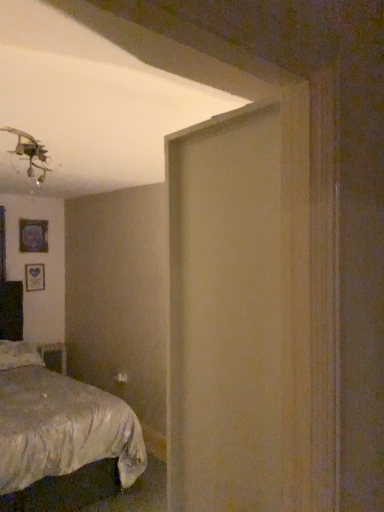
Question: Is silky white bed at lower left oriented towards matte black picture frame at upper left, which is counted as the second picture frame, starting from the bottom?

Choices:
 (A) yes
 (B) no

Answer: (B)

Question: Does silky white bed at lower left lie in front of matte black picture frame at upper left, the first picture frame from the top?

Choices:
 (A) yes
 (B) no

Answer: (A)

Question: From a real-world perspective, is silky white bed at lower left under matte black picture frame at upper left, the first picture frame from the top?

Choices:
 (A) yes
 (B) no

Answer: (A)

Question: From the image's perspective, is silky white bed at lower left located beneath matte black picture frame at upper left, the first picture frame from the top?

Choices:
 (A) no
 (B) yes

Answer: (B)

Question: Considering the relative sizes of silky white bed at lower left and matte black picture frame at upper left, the first picture frame from the top, in the image provided, is silky white bed at lower left wider than matte black picture frame at upper left, the first picture frame from the top,?

Choices:
 (A) no
 (B) yes

Answer: (B)

Question: From a real-world perspective, is wooden table at lower left above or below matte black picture frame at upper left, the first picture frame from the top?

Choices:
 (A) above
 (B) below

Answer: (B)

Question: Is wooden table at lower left inside or outside of matte black picture frame at upper left, the first picture frame from the top?

Choices:
 (A) inside
 (B) outside

Answer: (B)

Question: Based on their sizes in the image, would you say wooden table at lower left is bigger or smaller than matte black picture frame at upper left, which is counted as the second picture frame, starting from the bottom?

Choices:
 (A) big
 (B) small

Answer: (A)

Question: Relative to matte black picture frame at upper left, which is counted as the second picture frame, starting from the bottom, is wooden table at lower left in front or behind?

Choices:
 (A) behind
 (B) front

Answer: (A)

Question: Considering the positions of point (33, 221) and point (62, 376), is point (33, 221) closer or farther from the camera than point (62, 376)?

Choices:
 (A) closer
 (B) farther

Answer: (B)

Question: From a real-world perspective, relative to silky white bed at lower left, is matte black picture frame at upper left, the first picture frame from the top, vertically above or below?

Choices:
 (A) below
 (B) above

Answer: (B)

Question: In terms of height, does matte black picture frame at upper left, the first picture frame from the top, look taller or shorter compared to silky white bed at lower left?

Choices:
 (A) tall
 (B) short

Answer: (B)

Question: Considering the positions of matte black picture frame at upper left, the first picture frame from the top, and silky white bed at lower left in the image, is matte black picture frame at upper left, the first picture frame from the top, bigger or smaller than silky white bed at lower left?

Choices:
 (A) small
 (B) big

Answer: (A)

Question: Considering their positions, is wooden table at lower left located in front of or behind silky white bed at lower left?

Choices:
 (A) behind
 (B) front

Answer: (A)

Question: From the image's perspective, is wooden table at lower left located above or below silky white bed at lower left?

Choices:
 (A) above
 (B) below

Answer: (B)